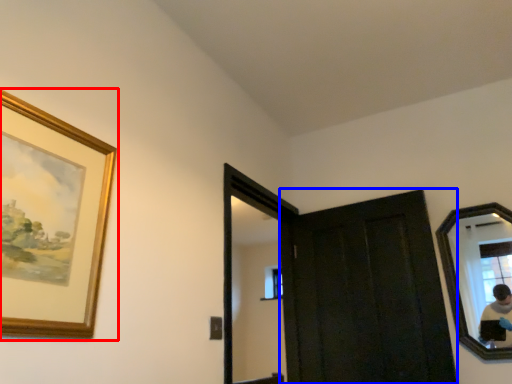
Question: Which object appears closest to the camera in this image, picture frame (highlighted by a red box) or door (highlighted by a blue box)?

Choices:
 (A) picture frame
 (B) door

Answer: (A)